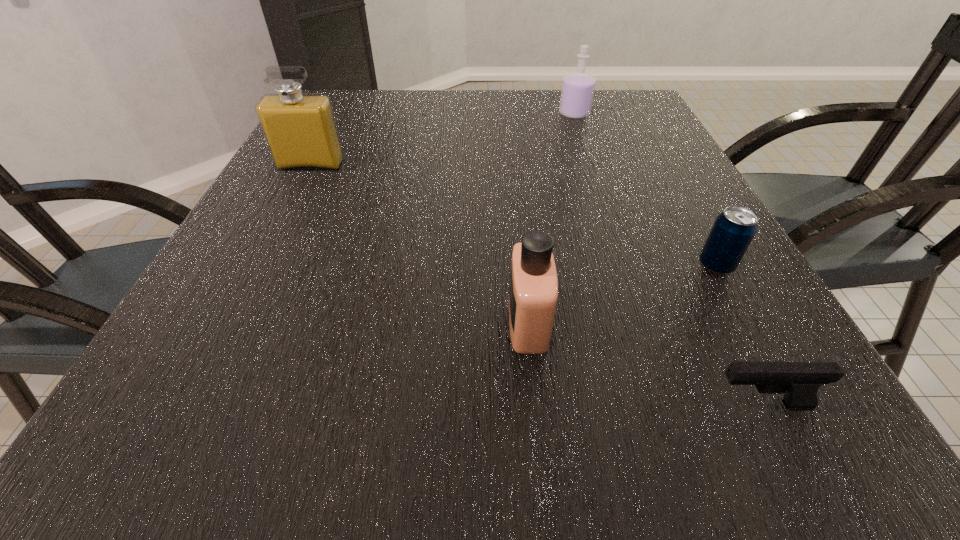
Find the location of a particular element. empty space that is in between the leftmost object and the farthest perfume is located at coordinates (443, 140).

Where is `the closest object relative to the nearest perfume`? The width and height of the screenshot is (960, 540). the closest object relative to the nearest perfume is located at coordinates click(x=799, y=381).

Select which object is the second closest to the nearest perfume. Please provide its 2D coordinates. Your answer should be formatted as a tuple, i.e. [(x, y)], where the tuple contains the x and y coordinates of a point satisfying the conditions above.

[(733, 230)]

The height and width of the screenshot is (540, 960). Find the location of `perfume identified as the closest to the fourth object from right to left`. perfume identified as the closest to the fourth object from right to left is located at coordinates (300, 129).

Identify which perfume is located as the nearest to the third farthest object. Please provide its 2D coordinates. Your answer should be formatted as a tuple, i.e. [(x, y)], where the tuple contains the x and y coordinates of a point satisfying the conditions above.

[(533, 293)]

Locate an element on the screen. This screenshot has width=960, height=540. free location that satisfies the following two spatial constraints: 1. on the front-facing side of the second farthest perfume; 2. on the left side of the second shortest object is located at coordinates tap(260, 266).